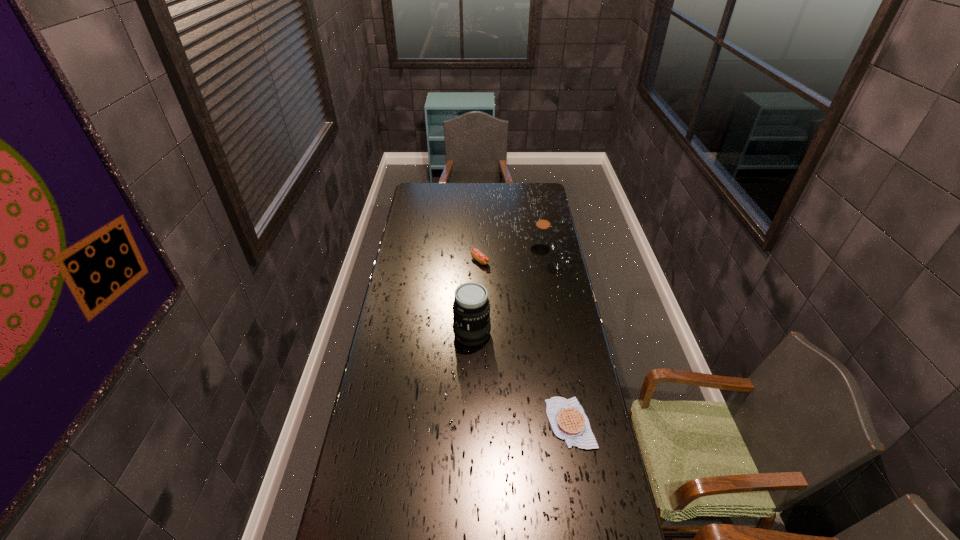
Locate an element on the screen. Image resolution: width=960 pixels, height=540 pixels. jar situated at the right edge is located at coordinates (541, 239).

Locate an element on the screen. The width and height of the screenshot is (960, 540). pie that is at the right edge is located at coordinates (567, 418).

The image size is (960, 540). In the image, there is a desktop. Identify the location of vacant space at the far edge. (481, 187).

The height and width of the screenshot is (540, 960). In order to click on blank area at the left edge in this screenshot , I will do `click(367, 483)`.

This screenshot has height=540, width=960. In the image, there is a desktop. Identify the location of vacant area at the right edge. (559, 364).

The width and height of the screenshot is (960, 540). I want to click on free space at the far right corner of the desktop, so click(534, 185).

I want to click on unoccupied area between the nearest object and the tallest object, so point(521,378).

You are a GUI agent. You are given a task and a screenshot of the screen. Output one action in this format:
    pyautogui.click(x=<x>, y=<y>)
    Task: Click on the free spot between the second tallest object and the second shortest object
    
    Given the screenshot: What is the action you would take?
    pyautogui.click(x=510, y=255)

Where is `vacant area between the third shortest object and the shortest object`? The height and width of the screenshot is (540, 960). vacant area between the third shortest object and the shortest object is located at coordinates 555,336.

At what (x,y) coordinates should I click in order to perform the action: click on free space between the pie and the third farthest object. Please return your answer as a coordinate pair (x, y). The image size is (960, 540). Looking at the image, I should click on (521, 378).